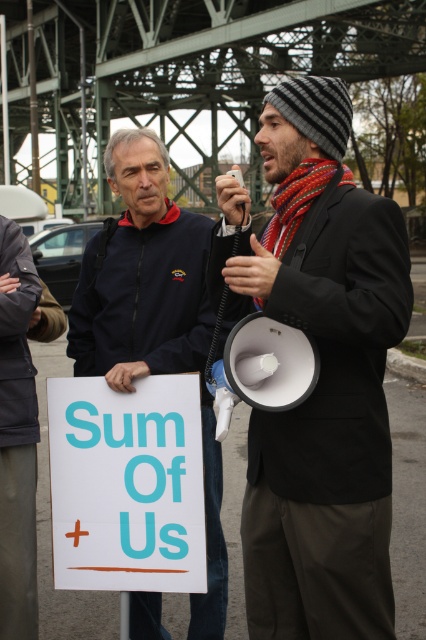
Question: In this image, where is matte black megaphone at center located relative to dark blue jacket at center?

Choices:
 (A) left
 (B) right

Answer: (B)

Question: Which of the following is the closest to the observer?

Choices:
 (A) matte black megaphone at center
 (B) dark blue jacket at center
 (C) white paper sign at center

Answer: (A)

Question: Is dark blue jacket at center to the right of white paper sign at center from the viewer's perspective?

Choices:
 (A) no
 (B) yes

Answer: (B)

Question: Estimate the real-world distances between objects in this image. Which object is farther from the white paper sign at center?

Choices:
 (A) matte black megaphone at center
 (B) dark blue jacket at center

Answer: (A)

Question: Considering the relative positions of matte black megaphone at center and white paper sign at center in the image provided, where is matte black megaphone at center located with respect to white paper sign at center?

Choices:
 (A) right
 (B) left

Answer: (A)

Question: Estimate the real-world distances between objects in this image. Which object is farther from the dark blue jacket at center?

Choices:
 (A) white paper sign at center
 (B) matte black megaphone at center

Answer: (B)